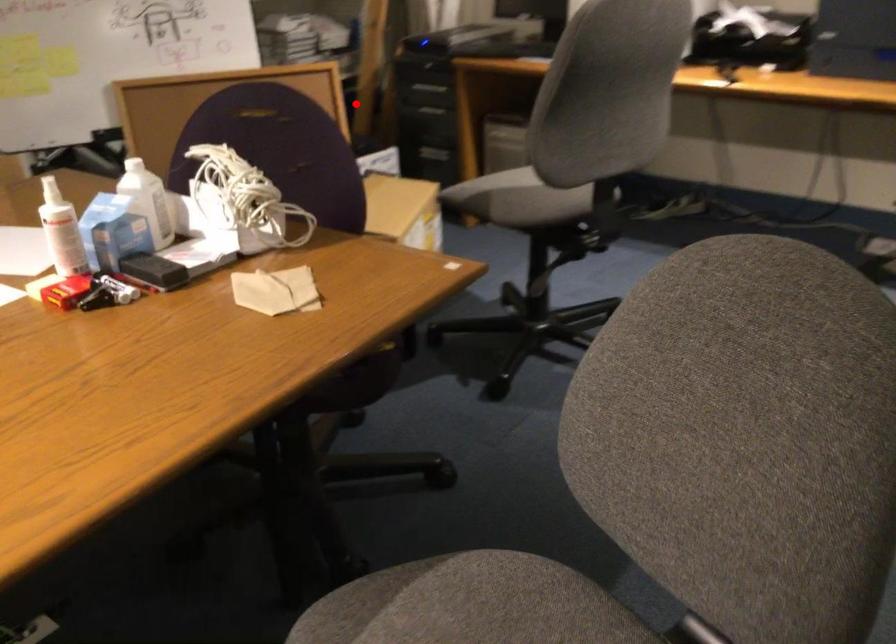
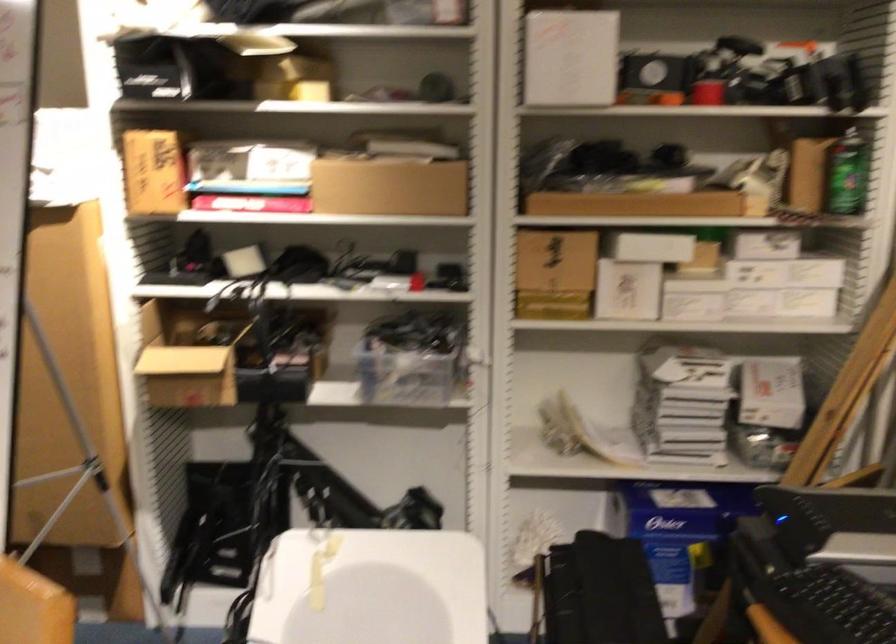
Find the pixel in the second image that matches the highlighted location in the first image.

(683, 534)